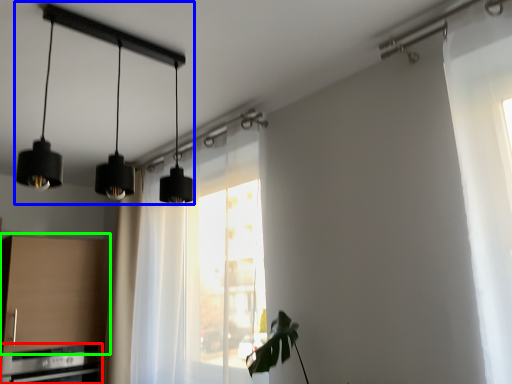
Question: Which object is the farthest from appliance (highlighted by a red box)? Choose among these: lamp (highlighted by a blue box) or cabinetry (highlighted by a green box).

Choices:
 (A) lamp
 (B) cabinetry

Answer: (A)